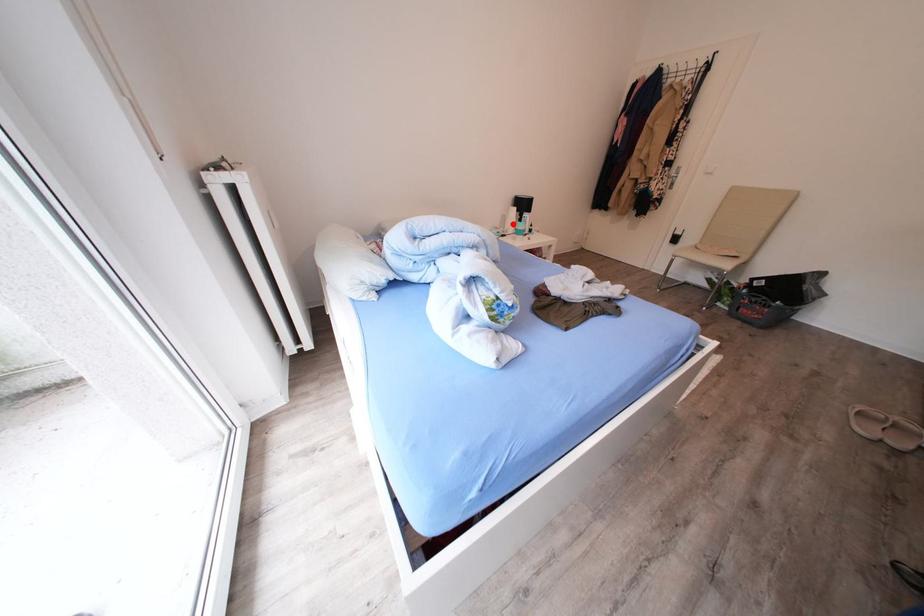
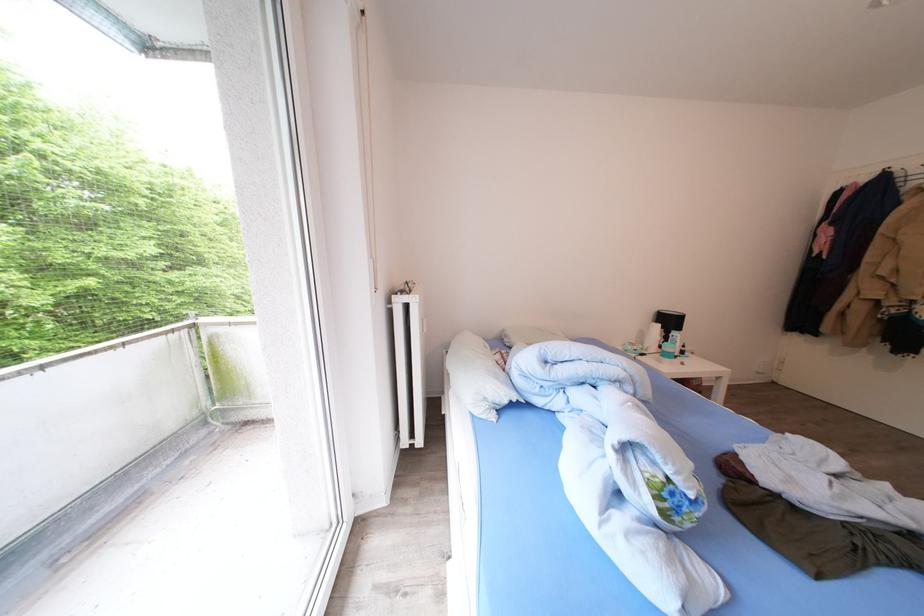
Locate, in the second image, the point that corresponds to the highlighted location in the first image.

(650, 339)